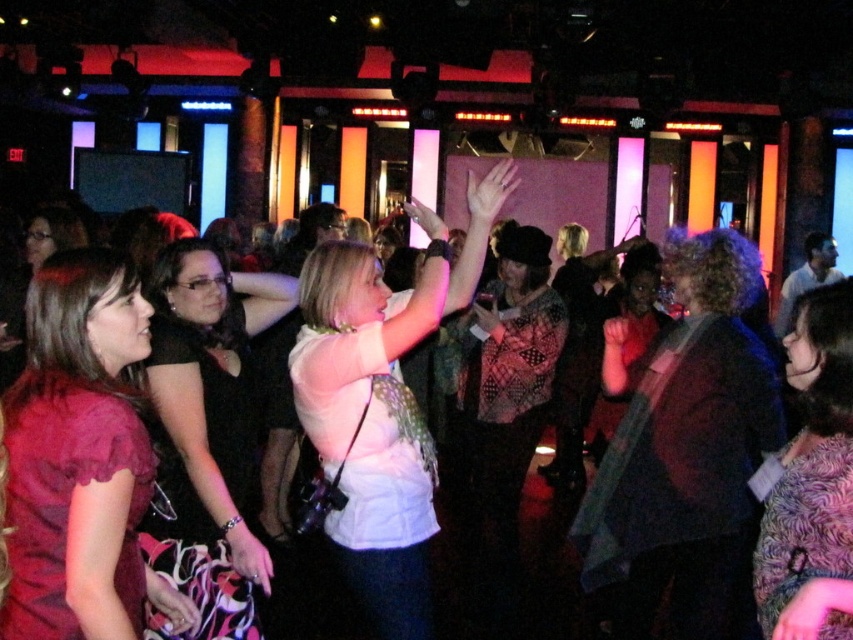
You are a photographer at the party and want to capture both the matte red dress at left and the black satin dress at center in the same frame. Since the dresses are different sizes, which one might appear closer to the camera in the photo?

The matte red dress at left has a smaller size compared to the black satin dress at center. In photography, smaller objects can appear farther away, so to have both in the same frame, the matte red dress at left might appear closer to the camera if positioned nearer, but based on size alone, the smaller matte red dress at left would naturally look farther away unless adjusted.

You are at a party and want to take a photo with both the dark brown textured jacket at center and the matte red dress at left. Which object should you focus on first to ensure both are in the frame?

The dark brown textured jacket at center is much taller than the matte red dress at left, so you should focus on positioning the camera to include the taller jacket first, ensuring the shorter dress is also visible in the frame.